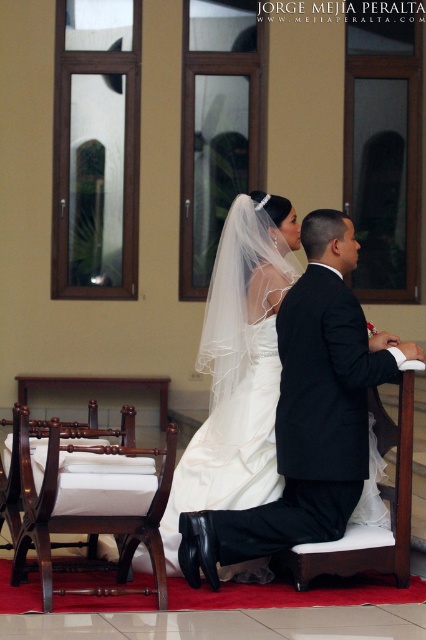
Question: Which of the following is the closest to the observer?

Choices:
 (A) (123, 516)
 (B) (253, 452)
 (C) (373, 548)

Answer: (A)

Question: Which point is farther to the camera?

Choices:
 (A) (227, 330)
 (B) (363, 560)
 (C) (144, 536)

Answer: (A)

Question: Does white satin dress at center have a greater width compared to white fabric cushion at lower center?

Choices:
 (A) no
 (B) yes

Answer: (B)

Question: Which object appears farthest from the camera in this image?

Choices:
 (A) white fabric cushion at lower center
 (B) white satin dress at center

Answer: (B)

Question: Can you confirm if white satin dress at center is positioned below mahogany wood chair at left?

Choices:
 (A) yes
 (B) no

Answer: (B)

Question: Can you confirm if white satin dress at center is wider than white fabric cushion at lower center?

Choices:
 (A) no
 (B) yes

Answer: (B)